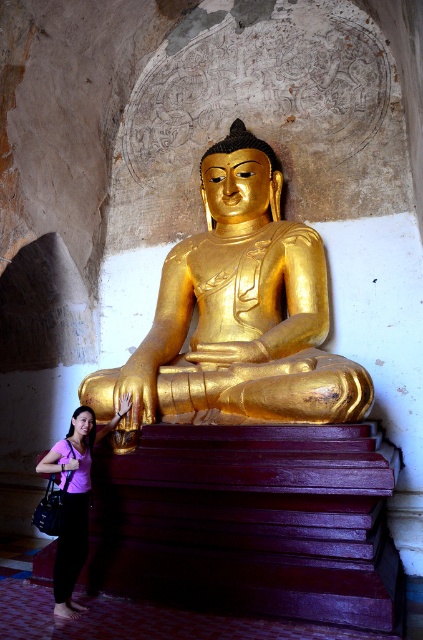
Can you confirm if wooden stairs at center is thinner than purple fabric shirt at lower left?

In fact, wooden stairs at center might be wider than purple fabric shirt at lower left.

Is point (120, 481) behind point (74, 616)?

Yes, point (120, 481) is behind point (74, 616).

What are the coordinates of `wooden stairs at center` in the screenshot? It's located at (250, 522).

Identify the location of wooden stairs at center. (250, 522).

Between point (376, 541) and point (327, 355), which one is positioned behind?

Point (327, 355)

Does point (239, 426) come behind point (272, 276)?

No.

Describe the element at coordinates (250, 522) in the screenshot. This screenshot has height=640, width=423. I see `wooden stairs at center` at that location.

Image resolution: width=423 pixels, height=640 pixels. I want to click on wooden stairs at center, so coord(250,522).

Is gold polished statue at center wider than purple fabric shirt at lower left?

Indeed, gold polished statue at center has a greater width compared to purple fabric shirt at lower left.

Is gold polished statue at center positioned at the back of purple fabric shirt at lower left?

That is True.

Who is more forward, (310, 401) or (79, 518)?

Point (310, 401) is in front.

Identify the location of gold polished statue at center. The height and width of the screenshot is (640, 423). (236, 314).